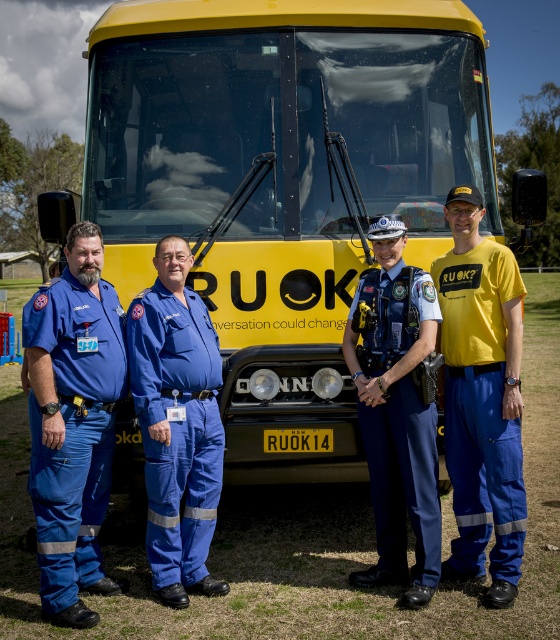
Between yellow matte bus at center and blue uniform at center, which one has more height?

yellow matte bus at center

Can you confirm if yellow matte bus at center is wider than blue uniform at center?

Yes, yellow matte bus at center is wider than blue uniform at center.

Find the location of a particular element. This screenshot has height=640, width=560. yellow matte bus at center is located at coordinates (282, 182).

Does yellow fabric shirt at center have a larger size compared to blue uniform at center?

Actually, yellow fabric shirt at center might be smaller than blue uniform at center.

Measure the distance between yellow fabric shirt at center and camera.

yellow fabric shirt at center is 3.96 meters away from camera.

Find the location of a particular element. This screenshot has width=560, height=640. yellow fabric shirt at center is located at coordinates (480, 408).

Is yellow matte bus at center thinner than yellow fabric shirt at center?

No.

How distant is yellow matte bus at center from yellow fabric shirt at center?

yellow matte bus at center and yellow fabric shirt at center are 3.58 feet apart.

Image resolution: width=560 pixels, height=640 pixels. What are the coordinates of `yellow matte bus at center` in the screenshot? It's located at (282, 182).